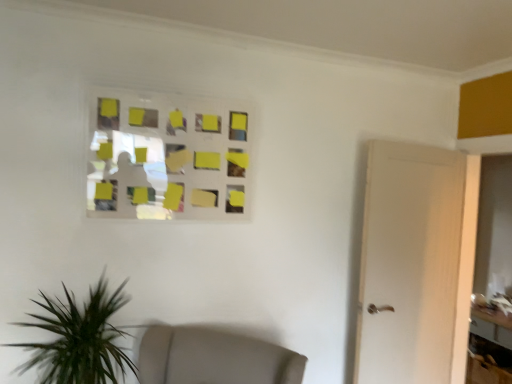
What do you see at coordinates (167, 157) in the screenshot?
I see `yellow matte glass window at upper center` at bounding box center [167, 157].

Identify the location of yellow matte glass window at upper center. (167, 157).

Describe the element at coordinates (489, 348) in the screenshot. Image resolution: width=512 pixels, height=384 pixels. I see `wooden table at lower right` at that location.

Where is `wooden table at lower right`? wooden table at lower right is located at coordinates (489, 348).

In order to face wooden table at lower right, should I rotate leftwards or rightwards?

To align with it, rotate right about 30.744°.

This screenshot has height=384, width=512. What are the coordinates of `yellow matte glass window at upper center` in the screenshot? It's located at (167, 157).

Based on the photo, which is more to the right, yellow matte glass window at upper center or wooden table at lower right?

wooden table at lower right is more to the right.

Considering the positions of objects yellow matte glass window at upper center and wooden table at lower right in the image provided, who is in front, yellow matte glass window at upper center or wooden table at lower right?

yellow matte glass window at upper center is more forward.

Is point (118, 186) more distant than point (478, 322)?

That is False.

From the image's perspective, does yellow matte glass window at upper center appear lower than wooden table at lower right?

Actually, yellow matte glass window at upper center appears above wooden table at lower right in the image.

From a real-world perspective, is yellow matte glass window at upper center positioned above or below wooden table at lower right?

→ Clearly, from a real-world perspective, yellow matte glass window at upper center is above wooden table at lower right.

Which of these two, yellow matte glass window at upper center or wooden table at lower right, is thinner?

With smaller width is yellow matte glass window at upper center.

Which of these two, yellow matte glass window at upper center or wooden table at lower right, stands taller?

Standing taller between the two is wooden table at lower right.

Can you confirm if yellow matte glass window at upper center is smaller than wooden table at lower right?

Indeed, yellow matte glass window at upper center has a smaller size compared to wooden table at lower right.

Which is correct: yellow matte glass window at upper center is inside wooden table at lower right, or outside of it?

yellow matte glass window at upper center is outside wooden table at lower right.

Can you see yellow matte glass window at upper center touching wooden table at lower right?

No, yellow matte glass window at upper center is not making contact with wooden table at lower right.

Could you tell me if yellow matte glass window at upper center is turned towards wooden table at lower right?

No, yellow matte glass window at upper center is not turned towards wooden table at lower right.

How many degrees apart are the facing directions of yellow matte glass window at upper center and wooden table at lower right?

They differ by 90.6 degrees in their facing directions.

How distant is yellow matte glass window at upper center from wooden table at lower right?

yellow matte glass window at upper center and wooden table at lower right are 9.10 feet apart from each other.

The height and width of the screenshot is (384, 512). Identify the location of glass window above the wooden table at lower right (from a real-world perspective). (167, 157).

Looking at this image, between wooden table at lower right and yellow matte glass window at upper center, which one appears on the left side from the viewer's perspective?

From the viewer's perspective, yellow matte glass window at upper center appears more on the left side.

Looking at this image, does wooden table at lower right come behind yellow matte glass window at upper center?

Yes.

Does point (507, 382) appear closer or farther from the camera than point (234, 200)?

Point (507, 382) is farther from the camera than point (234, 200).

From the image's perspective, is wooden table at lower right beneath yellow matte glass window at upper center?

Yes.

Consider the image. From a real-world perspective, which object stands above the other?

yellow matte glass window at upper center.

Which of these two, wooden table at lower right or yellow matte glass window at upper center, is wider?

Wider between the two is wooden table at lower right.

Which of these two, wooden table at lower right or yellow matte glass window at upper center, stands shorter?

Standing shorter between the two is yellow matte glass window at upper center.

Considering the relative sizes of wooden table at lower right and yellow matte glass window at upper center in the image provided, is wooden table at lower right bigger than yellow matte glass window at upper center?

Yes.

Which is correct: wooden table at lower right is inside yellow matte glass window at upper center, or outside of it?

wooden table at lower right cannot be found inside yellow matte glass window at upper center.

Are wooden table at lower right and yellow matte glass window at upper center beside each other?

There is a gap between wooden table at lower right and yellow matte glass window at upper center.

Is wooden table at lower right turned away from yellow matte glass window at upper center?

wooden table at lower right is not turned away from yellow matte glass window at upper center.

Measure the distance from wooden table at lower right to yellow matte glass window at upper center.

wooden table at lower right and yellow matte glass window at upper center are 2.77 meters apart.

The image size is (512, 384). I want to click on glass window on the left of wooden table at lower right, so click(167, 157).

This screenshot has height=384, width=512. I want to click on table below the yellow matte glass window at upper center (from a real-world perspective), so click(x=489, y=348).

In the image, there is a wooden table at lower right. Where is `glass window above it (from the image's perspective)`? glass window above it (from the image's perspective) is located at coordinates (167, 157).